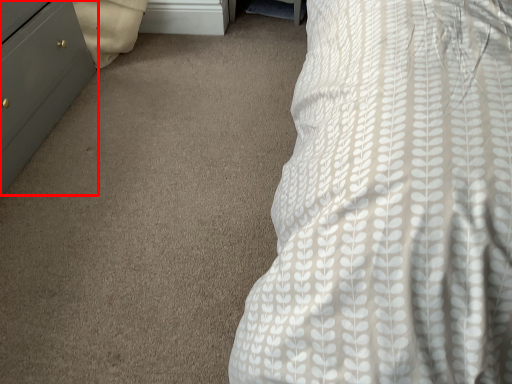
Question: Observing the image, what is the correct spatial positioning of chest of drawers (annotated by the red box) in reference to file cabinet?

Choices:
 (A) left
 (B) right

Answer: (A)